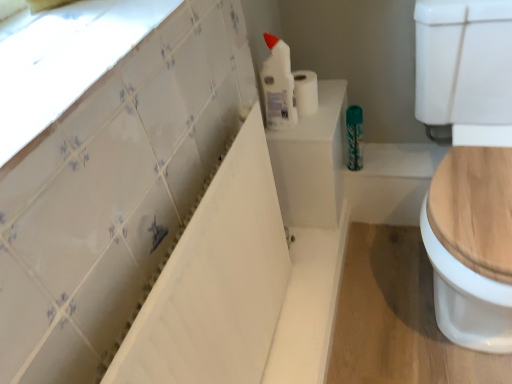
Question: Is white matte toilet paper at upper center far from white glossy bottle at upper center?

Choices:
 (A) no
 (B) yes

Answer: (A)

Question: Can you confirm if white matte toilet paper at upper center is thinner than white glossy bottle at upper center?

Choices:
 (A) no
 (B) yes

Answer: (A)

Question: Is white matte toilet paper at upper center oriented away from white glossy bottle at upper center?

Choices:
 (A) no
 (B) yes

Answer: (A)

Question: Is white matte toilet paper at upper center smaller than white glossy bottle at upper center?

Choices:
 (A) no
 (B) yes

Answer: (B)

Question: Does white matte toilet paper at upper center appear on the left side of white glossy bottle at upper center?

Choices:
 (A) no
 (B) yes

Answer: (A)

Question: Does white matte toilet paper at upper center turn towards white glossy bottle at upper center?

Choices:
 (A) yes
 (B) no

Answer: (B)

Question: Does white matte toilet paper at upper center appear on the right side of teal metallic can at center?

Choices:
 (A) no
 (B) yes

Answer: (A)

Question: Does white matte toilet paper at upper center lie in front of teal metallic can at center?

Choices:
 (A) yes
 (B) no

Answer: (A)

Question: Is white matte toilet paper at upper center turned away from teal metallic can at center?

Choices:
 (A) yes
 (B) no

Answer: (B)

Question: Considering the relative sizes of white matte toilet paper at upper center and teal metallic can at center in the image provided, is white matte toilet paper at upper center taller than teal metallic can at center?

Choices:
 (A) no
 (B) yes

Answer: (A)

Question: From a real-world perspective, is white matte toilet paper at upper center on top of teal metallic can at center?

Choices:
 (A) yes
 (B) no

Answer: (A)

Question: Does white matte toilet paper at upper center come behind teal metallic can at center?

Choices:
 (A) no
 (B) yes

Answer: (A)

Question: From the image's perspective, does white glossy bathtub at upper left appear lower than white glossy tile at upper left?

Choices:
 (A) no
 (B) yes

Answer: (B)